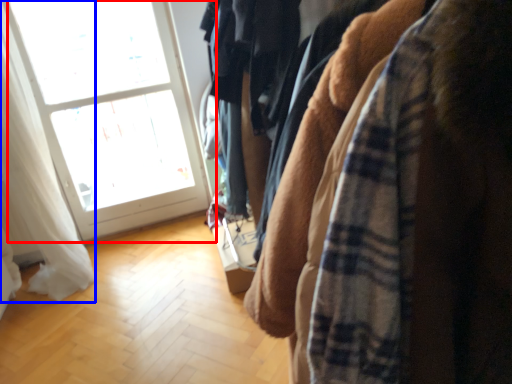
Question: Which of the following is the farthest to the observer, window (highlighted by a red box) or curtain (highlighted by a blue box)?

Choices:
 (A) window
 (B) curtain

Answer: (A)